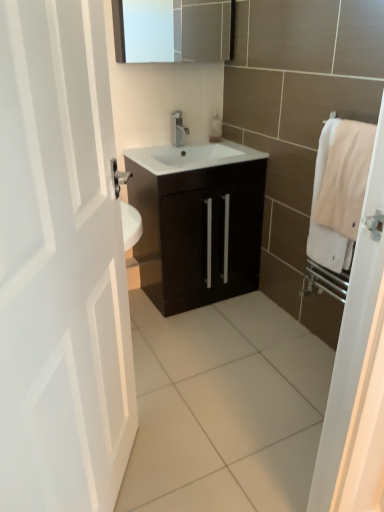
Describe the element at coordinates (186, 33) in the screenshot. I see `matte silver medicine cabinet at upper center` at that location.

At what (x,y) coordinates should I click in order to perform the action: click on translucent plastic soap dispenser at center. Please return your answer as a coordinate pair (x, y). Looking at the image, I should click on (215, 128).

What do you see at coordinates (215, 128) in the screenshot?
I see `translucent plastic soap dispenser at center` at bounding box center [215, 128].

Describe the element at coordinates (60, 265) in the screenshot. I see `white matte door at left` at that location.

What is the approximate width of satin nickel faucet at center?

satin nickel faucet at center is 4.10 inches wide.

In order to click on matte silver medicine cabinet at upper center in this screenshot , I will do tap(186, 33).

Based on the photo, does white matte door at left have a larger size compared to matte silver medicine cabinet at upper center?

Indeed, white matte door at left has a larger size compared to matte silver medicine cabinet at upper center.

Considering the positions of objects white matte door at left and matte silver medicine cabinet at upper center in the image provided, who is in front, white matte door at left or matte silver medicine cabinet at upper center?

white matte door at left is closer to the camera.

From the image's perspective, is white matte door at left on matte silver medicine cabinet at upper center?

Incorrect, from the image's perspective, white matte door at left is lower than matte silver medicine cabinet at upper center.

How much distance is there between white matte door at left and matte silver medicine cabinet at upper center?

white matte door at left is 1.80 meters from matte silver medicine cabinet at upper center.

From the image's perspective, is white cotton bath towel at right above or below satin nickel faucet at center?

From the image's perspective, white cotton bath towel at right appears below satin nickel faucet at center.

From a real-world perspective, is white cotton bath towel at right below satin nickel faucet at center?

Yes, from a real-world perspective, white cotton bath towel at right is beneath satin nickel faucet at center.

Considering the relative sizes of white cotton bath towel at right and satin nickel faucet at center in the image provided, is white cotton bath towel at right smaller than satin nickel faucet at center?

Incorrect, white cotton bath towel at right is not smaller in size than satin nickel faucet at center.

From the image's perspective, between matte silver medicine cabinet at upper center and dark wood cabinet at center, which one is located above?

matte silver medicine cabinet at upper center.

At what (x,y) coordinates should I click in order to perform the action: click on medicine cabinet above the dark wood cabinet at center (from the image's perspective). Please return your answer as a coordinate pair (x, y). The image size is (384, 512). Looking at the image, I should click on (186, 33).

Does point (122, 30) appear closer or farther from the camera than point (235, 249)?

Clearly, point (122, 30) is closer to the camera than point (235, 249).

Between matte silver medicine cabinet at upper center and dark wood cabinet at center, which one has larger width?

dark wood cabinet at center is wider.

From the image's perspective, which one is positioned higher, matte silver medicine cabinet at upper center or white matte door at left?

From the image's view, matte silver medicine cabinet at upper center is above.

Is point (194, 13) less distant than point (70, 12)?

No, (194, 13) is further to viewer.

Between matte silver medicine cabinet at upper center and white matte door at left, which one has larger size?

white matte door at left is bigger.

Is white matte door at left further to camera compared to translucent plastic soap dispenser at center?

No, it is in front of translucent plastic soap dispenser at center.

From the picture: Which is more to the left, white matte door at left or translucent plastic soap dispenser at center?

From the viewer's perspective, white matte door at left appears more on the left side.

Can you confirm if white matte door at left is smaller than translucent plastic soap dispenser at center?

No, white matte door at left is not smaller than translucent plastic soap dispenser at center.

Is point (15, 414) closer to camera compared to point (220, 121)?

Yes.

From the image's perspective, would you say dark wood cabinet at center is positioned over white matte door at left?

Yes, from the image's perspective, dark wood cabinet at center is on top of white matte door at left.

Consider the image. Is dark wood cabinet at center oriented away from white matte door at left?

No, dark wood cabinet at center is not facing the opposite direction of white matte door at left.

Considering the sizes of objects dark wood cabinet at center and white matte door at left in the image provided, who is shorter, dark wood cabinet at center or white matte door at left?

Standing shorter between the two is dark wood cabinet at center.

From a real-world perspective, which object stands above the other?

From a 3D spatial view, white matte door at left is above.

The height and width of the screenshot is (512, 384). Find the location of `tap on the right of white matte door at left`. tap on the right of white matte door at left is located at coordinates (178, 129).

Can we say white matte door at left lies outside satin nickel faucet at center?

Yes, white matte door at left is outside of satin nickel faucet at center.

Can you tell me how much white matte door at left and satin nickel faucet at center differ in facing direction?

55.1 degrees.

Is white matte door at left next to satin nickel faucet at center?

No, white matte door at left is not with satin nickel faucet at center.

This screenshot has height=512, width=384. Find the location of `door below the matte silver medicine cabinet at upper center (from a real-world perspective)`. door below the matte silver medicine cabinet at upper center (from a real-world perspective) is located at coordinates (60, 265).

Locate an element on the screen. The width and height of the screenshot is (384, 512). tap on the left of white cotton bath towel at right is located at coordinates (178, 129).

Looking at the image, which one is located further to dark wood cabinet at center, matte silver medicine cabinet at upper center or translucent plastic soap dispenser at center?

Among the two, matte silver medicine cabinet at upper center is located further to dark wood cabinet at center.

Estimate the real-world distances between objects in this image. Which object is further from translucent plastic soap dispenser at center, white matte door at left or white cotton bath towel at right?

Based on the image, white matte door at left appears to be further to translucent plastic soap dispenser at center.

Looking at the image, which one is located closer to white cotton bath towel at right, translucent plastic soap dispenser at center or satin nickel faucet at center?

satin nickel faucet at center is positioned closer to the anchor white cotton bath towel at right.

Considering their positions, is matte silver medicine cabinet at upper center positioned further to white matte door at left than translucent plastic soap dispenser at center?

matte silver medicine cabinet at upper center is further to white matte door at left.

Looking at the image, which one is located closer to dark wood cabinet at center, satin nickel faucet at center or translucent plastic soap dispenser at center?

satin nickel faucet at center.

From the image, which object appears to be farther from dark wood cabinet at center, white cotton bath towel at right or satin nickel faucet at center?

Based on the image, white cotton bath towel at right appears to be further to dark wood cabinet at center.

From the image, which object appears to be farther from matte silver medicine cabinet at upper center, dark wood cabinet at center or translucent plastic soap dispenser at center?

dark wood cabinet at center lies further to matte silver medicine cabinet at upper center than the other object.

Which object lies nearer to the anchor point matte silver medicine cabinet at upper center, satin nickel faucet at center or dark wood cabinet at center?

satin nickel faucet at center is positioned closer to the anchor matte silver medicine cabinet at upper center.

The image size is (384, 512). What are the coordinates of `bathroom cabinet between white matte door at left and matte silver medicine cabinet at upper center from front to back` in the screenshot? It's located at (197, 222).

Locate an element on the screen. The image size is (384, 512). tap positioned between matte silver medicine cabinet at upper center and translucent plastic soap dispenser at center from near to far is located at coordinates (178, 129).

I want to click on tap between matte silver medicine cabinet at upper center and dark wood cabinet at center from top to bottom, so click(178, 129).

What are the coordinates of `bath towel between white matte door at left and dark wood cabinet at center in the front-back direction` in the screenshot? It's located at (339, 191).